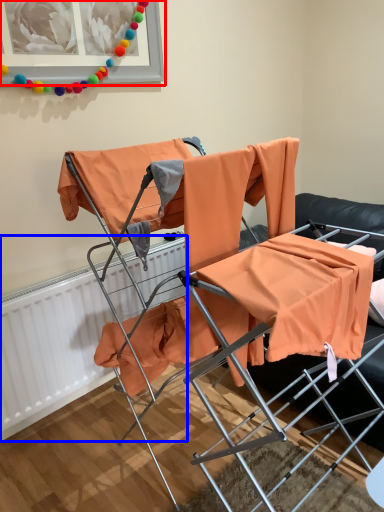
Question: Which of the following is the farthest to the observer, picture frame (highlighted by a red box) or radiator (highlighted by a blue box)?

Choices:
 (A) picture frame
 (B) radiator

Answer: (B)